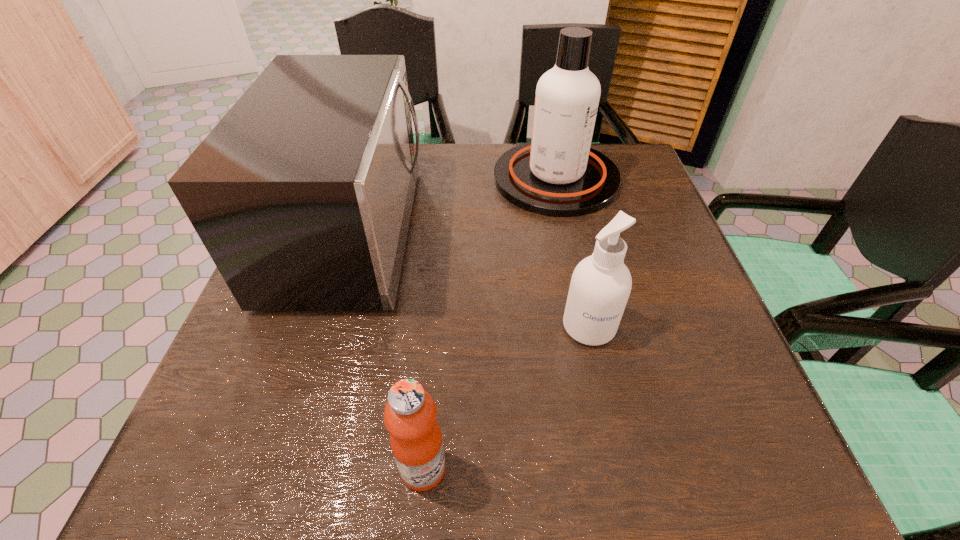
The width and height of the screenshot is (960, 540). I want to click on the tallest object, so click(557, 174).

This screenshot has height=540, width=960. Identify the location of the farther cleansing agent. (557, 174).

You are a GUI agent. You are given a task and a screenshot of the screen. Output one action in this format:
    pyautogui.click(x=<x>, y=<y>)
    Task: Click on the microwave oven
    
    Given the screenshot: What is the action you would take?
    pyautogui.click(x=302, y=194)

Find the location of a particular element. Image resolution: width=960 pixels, height=540 pixels. the third shortest object is located at coordinates (302, 194).

At what (x,y) coordinates should I click in order to perform the action: click on the shorter cleansing agent. Please return your answer as a coordinate pair (x, y). This screenshot has height=540, width=960. Looking at the image, I should click on (600, 286).

The height and width of the screenshot is (540, 960). In order to click on the third tallest object in this screenshot , I will do `click(600, 286)`.

In order to click on the third object from right to left in this screenshot , I will do `click(410, 414)`.

I want to click on fruit juice, so tap(410, 414).

You are a GUI agent. You are given a task and a screenshot of the screen. Output one action in this format:
    pyautogui.click(x=<x>, y=<y>)
    Task: Click on the blank space located 0.320m on the left of the tallest object
    
    Given the screenshot: What is the action you would take?
    pyautogui.click(x=371, y=179)

Where is `free spot located 0.400m with the door open on the third shortest object`? This screenshot has height=540, width=960. free spot located 0.400m with the door open on the third shortest object is located at coordinates (597, 231).